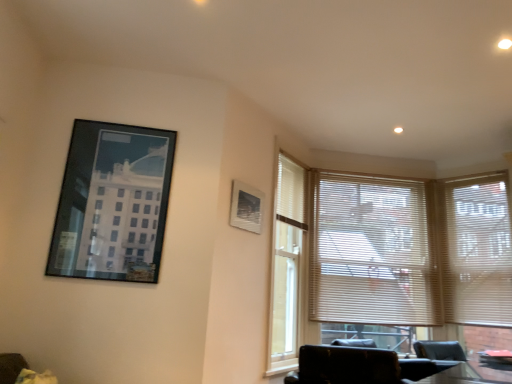
Question: Is white blinds at right, the 1th window blind positioned from the right, turned away from matte black picture frame at upper left, the first picture frame from the left?

Choices:
 (A) yes
 (B) no

Answer: (B)

Question: Considering the relative sizes of white blinds at right, the 1th window blind positioned from the right, and matte black picture frame at upper left, the first picture frame from the left, in the image provided, is white blinds at right, the 1th window blind positioned from the right, wider than matte black picture frame at upper left, the first picture frame from the left,?

Choices:
 (A) no
 (B) yes

Answer: (B)

Question: Can you confirm if white blinds at right, the 1th window blind positioned from the right, is thinner than matte black picture frame at upper left, which ranks as the 2th picture frame in back-to-front order?

Choices:
 (A) yes
 (B) no

Answer: (B)

Question: Does white blinds at right, placed as the second window blind when sorted from left to right, have a larger size compared to matte black picture frame at upper left, which ranks as the 2th picture frame in back-to-front order?

Choices:
 (A) no
 (B) yes

Answer: (B)

Question: From a real-world perspective, is white blinds at right, placed as the second window blind when sorted from left to right, positioned under matte black picture frame at upper left, which appears as the second picture frame when viewed from the right, based on gravity?

Choices:
 (A) yes
 (B) no

Answer: (B)

Question: Is matte white picture frame at upper center, the first picture frame viewed from the right, inside the boundaries of white blinds at right, the 1th window blind positioned from the right, or outside?

Choices:
 (A) outside
 (B) inside

Answer: (A)

Question: From the image's perspective, relative to white blinds at right, placed as the second window blind when sorted from left to right, is matte white picture frame at upper center, the first picture frame viewed from the right, above or below?

Choices:
 (A) above
 (B) below

Answer: (A)

Question: Based on their positions, is matte white picture frame at upper center, positioned as the first picture frame in back-to-front order, located to the left or right of white blinds at right, the 1th window blind positioned from the right?

Choices:
 (A) right
 (B) left

Answer: (B)

Question: Based on their sizes in the image, would you say matte white picture frame at upper center, which appears as the second picture frame when viewed from the left, is bigger or smaller than white blinds at right, the 1th window blind positioned from the right?

Choices:
 (A) small
 (B) big

Answer: (A)

Question: Considering the positions of black leather chair at lower right and matte white picture frame at upper center, the first picture frame viewed from the right, in the image, is black leather chair at lower right taller or shorter than matte white picture frame at upper center, the first picture frame viewed from the right,?

Choices:
 (A) short
 (B) tall

Answer: (A)

Question: In terms of width, does black leather chair at lower right look wider or thinner when compared to matte white picture frame at upper center, which appears as the second picture frame when viewed from the left?

Choices:
 (A) wide
 (B) thin

Answer: (A)

Question: Is point (351, 377) closer or farther from the camera than point (248, 185)?

Choices:
 (A) closer
 (B) farther

Answer: (A)

Question: Based on their positions, is black leather chair at lower right located to the left or right of matte white picture frame at upper center, positioned as the second picture frame in front-to-back order?

Choices:
 (A) left
 (B) right

Answer: (B)

Question: Would you say beige/wooden blinds at center, which appears as the 1th window blind when viewed from the left, is inside or outside matte black picture frame at upper left, which appears as the first picture frame when viewed from the front?

Choices:
 (A) inside
 (B) outside

Answer: (B)

Question: From the image's perspective, is beige/wooden blinds at center, the 2th window blind positioned from the right, above or below matte black picture frame at upper left, which ranks as the 2th picture frame in back-to-front order?

Choices:
 (A) above
 (B) below

Answer: (B)